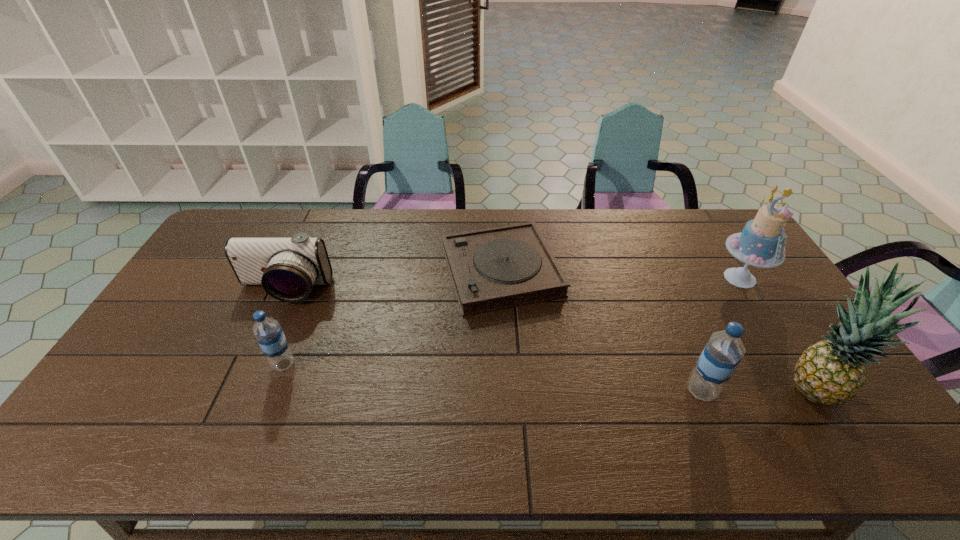
Please mark a free spot for a new water_bottle to balance the arrangement. Please provide its 2D coordinates. Your answer should be formatted as a tuple, i.e. [(x, y)], where the tuple contains the x and y coordinates of a point satisfying the conditions above.

[(487, 377)]